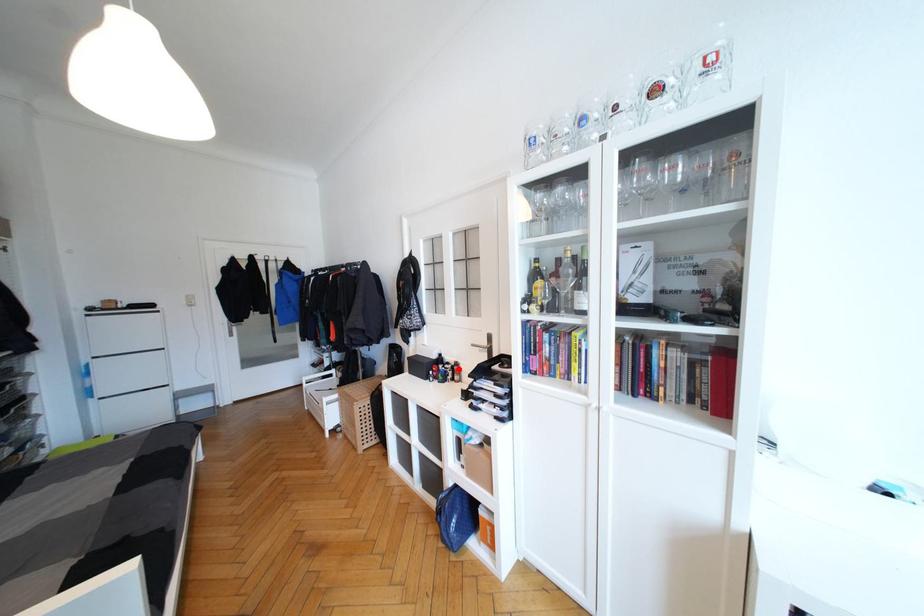
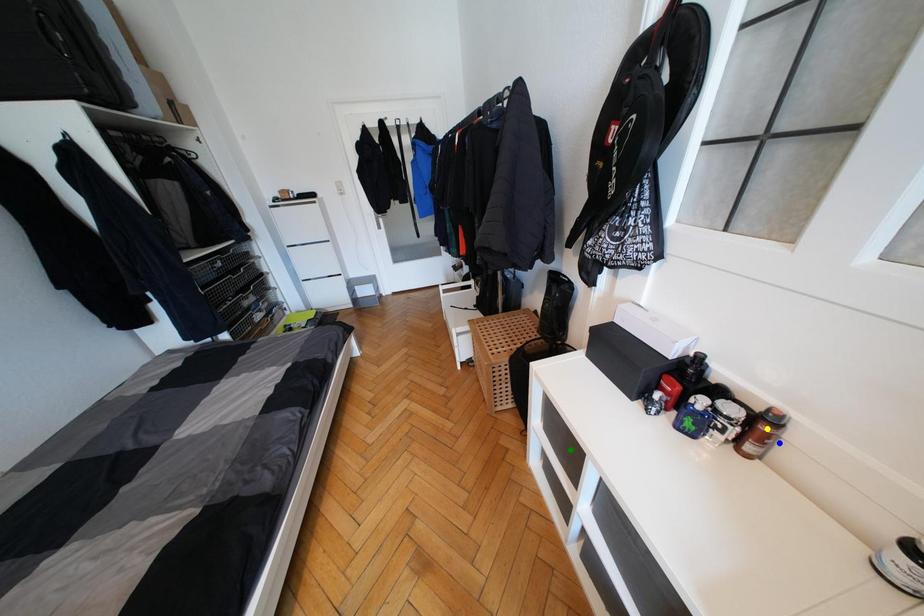
Question: I am providing you with two images of the same scene from different viewpoints. A red point is marked on the first image. You are given multiple points on the second image. In image 2, which mark is for the same physical point as the one in image 1?

Choices:
 (A) green point
 (B) blue point
 (C) yellow point

Answer: (C)